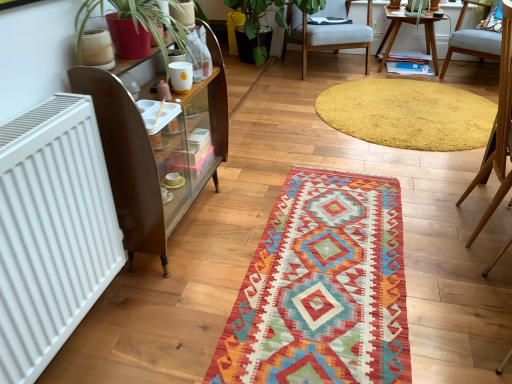
Locate an element on the screen. The image size is (512, 384). vacant area that is situated to the right of multicolored woven mat at center, which is the 2th mat in back-to-front order is located at coordinates (441, 227).